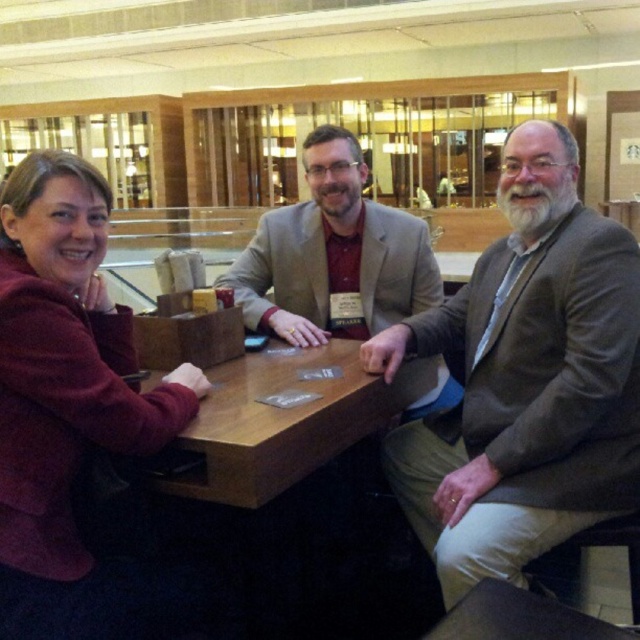
You are sitting at the table and want to hand a document to both the maroon fleece jacket at left and the matte gray blazer at center. Which person should you hand the document to first to ensure you can reach both without moving from your seat?

You should hand the document to the maroon fleece jacket at left first because they are closer to you than the matte gray blazer at center, so you can reach them first without moving.

You are a photographer standing behind the camera, positioned at the end of the table. You want to capture a photo that includes both the maroon fleece jacket at left and the matte gray blazer at center. Given that your camera has a maximum zoom of 50 inches, will you be able to fit both subjects into the frame without moving closer?

The maroon fleece jacket at left is 32.38 inches from the matte gray blazer at center. Since the distance between them is within the camera maximum zoom of 50 inches, you can fit both subjects into the frame without moving closer.

You are standing in a conference room and see the matte gray blazer at center. If you want to reach the blazer without moving any furniture, can you do so if your maximum reach is 2 meters?

The distance between you and the matte gray blazer at center is 2.05 meters, which is slightly beyond your 2 meter reach. You cannot reach it without moving closer or using an object to extend your reach.